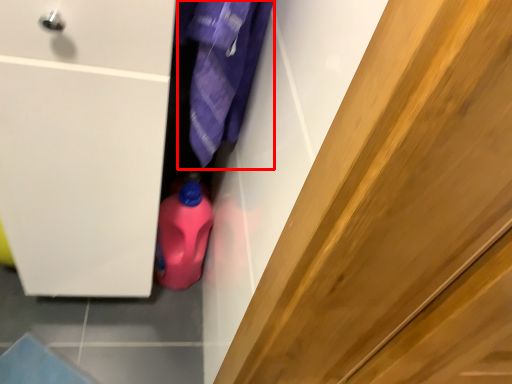
Question: Observing the image, what is the correct spatial positioning of clothing (annotated by the red box) in reference to cleaning product?

Choices:
 (A) left
 (B) right

Answer: (B)